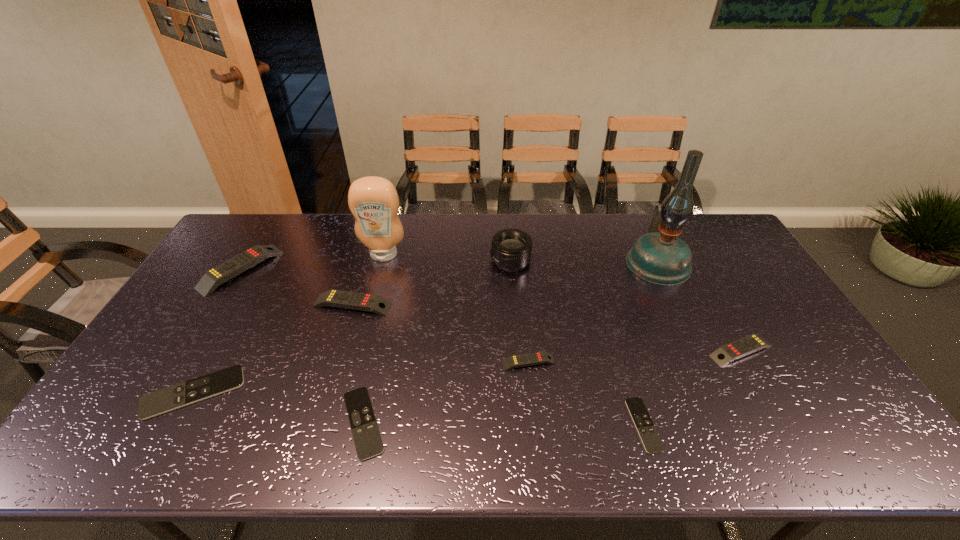
At what (x,y) coordinates should I click in order to perform the action: click on vacant position in the image that satisfies the following two spatial constraints: 1. on the label of the condiment; 2. on the left side of the third remote control from right to left. Please return your answer as a coordinate pair (x, y). Looking at the image, I should click on [356, 362].